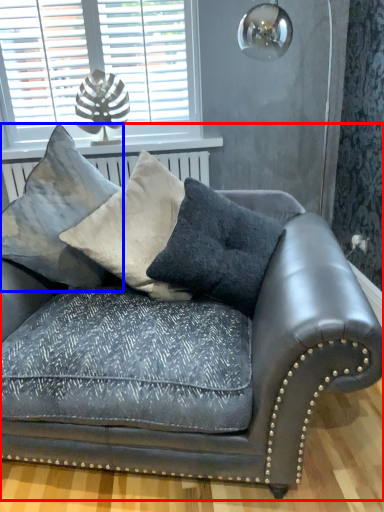
Question: Which of the following is the farthest to the observer, studio couch (highlighted by a red box) or pillow (highlighted by a blue box)?

Choices:
 (A) studio couch
 (B) pillow

Answer: (B)